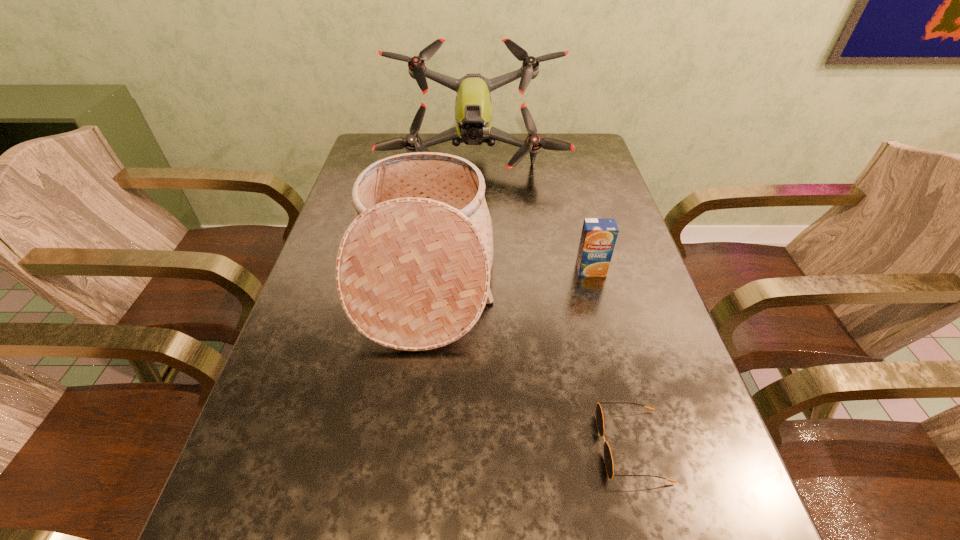
I want to click on the tallest object, so click(473, 112).

This screenshot has width=960, height=540. In order to click on drone in this screenshot , I will do `click(473, 112)`.

Locate an element on the screen. The height and width of the screenshot is (540, 960). basket is located at coordinates (412, 273).

The image size is (960, 540). Identify the location of the second shortest object. (599, 235).

Where is `sunglasses`? Image resolution: width=960 pixels, height=540 pixels. sunglasses is located at coordinates (608, 459).

This screenshot has width=960, height=540. What are the coordinates of `the nearest object` in the screenshot? It's located at (608, 459).

Where is `vacant region located 0.050m on the front-facing side of the drone`? vacant region located 0.050m on the front-facing side of the drone is located at coordinates (473, 195).

In order to click on vacant space positioned 0.180m with the lid open on the third shortest object in this screenshot , I will do `click(570, 276)`.

Where is `blank space located 0.140m on the left of the third tallest object`? This screenshot has height=540, width=960. blank space located 0.140m on the left of the third tallest object is located at coordinates (517, 271).

You are a GUI agent. You are given a task and a screenshot of the screen. Output one action in this format:
    pyautogui.click(x=<x>, y=<y>)
    Task: Click on the free spot located 0.230m on the front-facing side of the nearest object
    This screenshot has width=960, height=540.
    Given the screenshot: What is the action you would take?
    pyautogui.click(x=462, y=446)